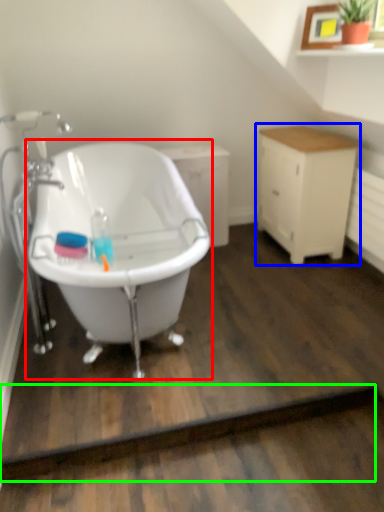
Question: Which is nearer to the bathtub (highlighted by a red box)? cabinetry (highlighted by a blue box) or plank (highlighted by a green box).

Choices:
 (A) cabinetry
 (B) plank

Answer: (B)